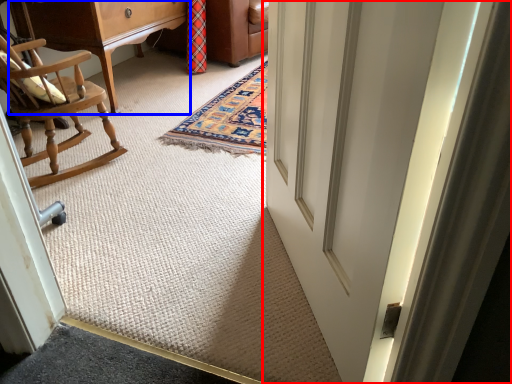
Question: Which point is further to the camera, door (highlighted by a red box) or furniture (highlighted by a blue box)?

Choices:
 (A) door
 (B) furniture

Answer: (B)